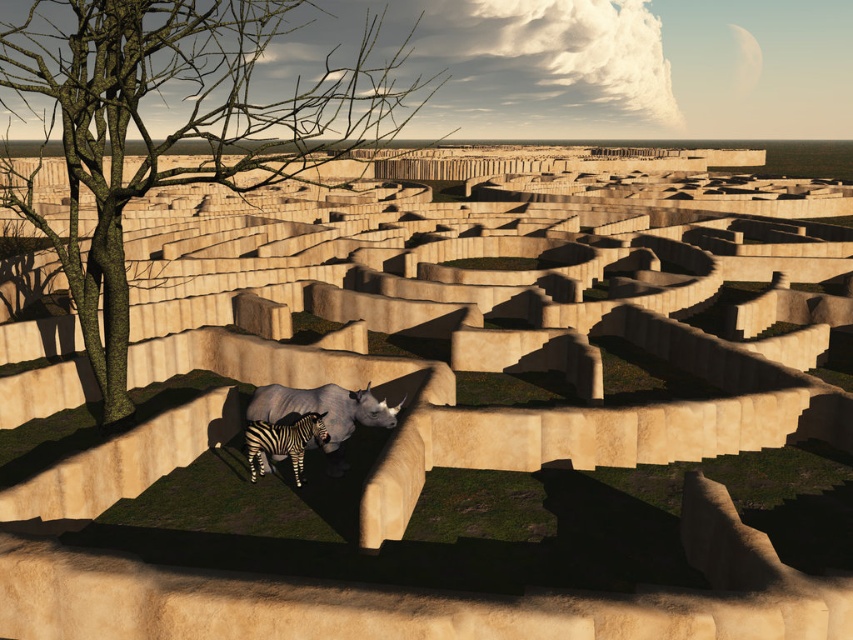
Question: Which object is positioned farthest from the gray matte rhino at center?

Choices:
 (A) black and white striped zebra at center
 (B) green leafy tree at left

Answer: (B)

Question: Does green leafy tree at left appear over gray matte rhino at center?

Choices:
 (A) no
 (B) yes

Answer: (B)

Question: Which point is farther to the camera?

Choices:
 (A) gray matte rhino at center
 (B) black and white striped zebra at center
 (C) green leafy tree at left

Answer: (A)

Question: Can you confirm if green leafy tree at left is thinner than gray matte rhino at center?

Choices:
 (A) yes
 (B) no

Answer: (B)

Question: Does gray matte rhino at center lie behind black and white striped zebra at center?

Choices:
 (A) yes
 (B) no

Answer: (A)

Question: Among these objects, which one is nearest to the camera?

Choices:
 (A) black and white striped zebra at center
 (B) gray matte rhino at center

Answer: (A)